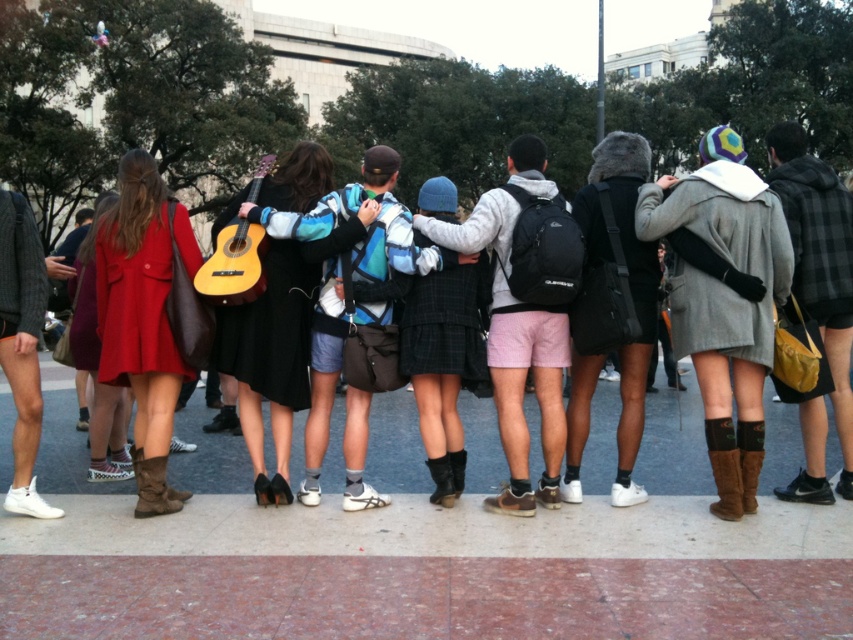
Who is lower down, matte red coat at left or brown fuzzy boot at lower center?

brown fuzzy boot at lower center is lower down.

Is point (122, 205) less distant than point (751, 458)?

No, it is behind (751, 458).

Between point (172, 372) and point (743, 448), which one is positioned in front?

Positioned in front is point (743, 448).

This screenshot has height=640, width=853. Identify the location of matte red coat at left. (143, 317).

Identify the location of pink marble pavement at center. Image resolution: width=853 pixels, height=640 pixels. click(427, 544).

Between point (236, 621) and point (751, 438), which one is positioned in front?

Point (236, 621)

Where is `pink marble pavement at center`? The width and height of the screenshot is (853, 640). pink marble pavement at center is located at coordinates (427, 544).

Is brown suede boot at lower left shorter than brown fuzzy boot at lower center?

Correct, brown suede boot at lower left is not as tall as brown fuzzy boot at lower center.

Does brown suede boot at lower left appear over brown fuzzy boot at lower center?

No, brown suede boot at lower left is not above brown fuzzy boot at lower center.

Who is more distant from viewer, (163, 467) or (740, 465)?

Positioned behind is point (163, 467).

The image size is (853, 640). In order to click on brown suede boot at lower left in this screenshot , I will do `click(154, 486)`.